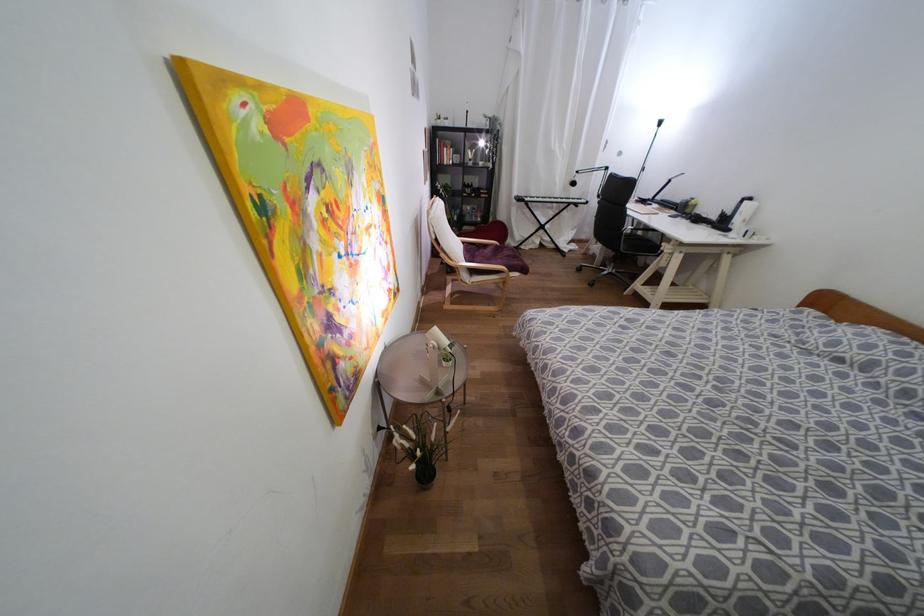
Where is `bottle pump top`? This screenshot has width=924, height=616. bottle pump top is located at coordinates (742, 215).